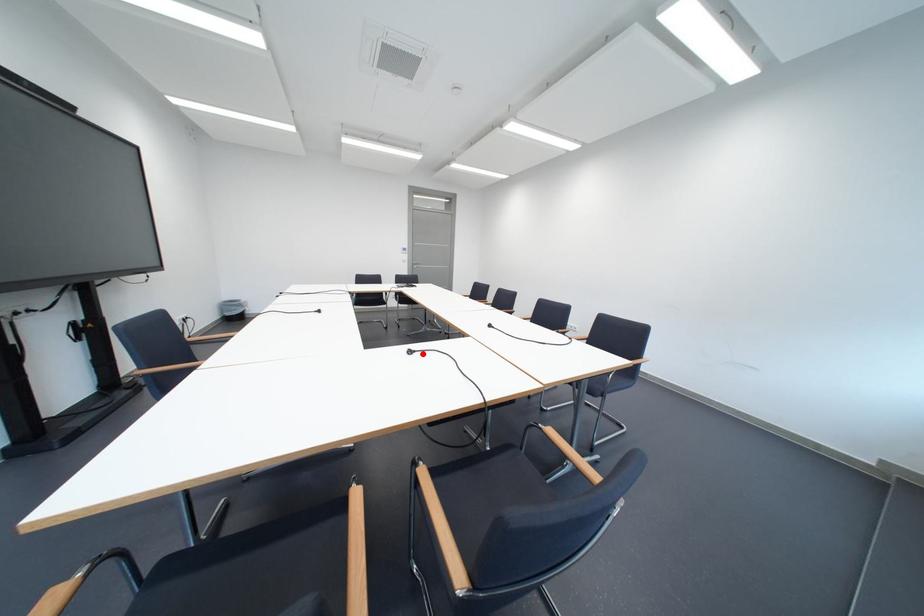
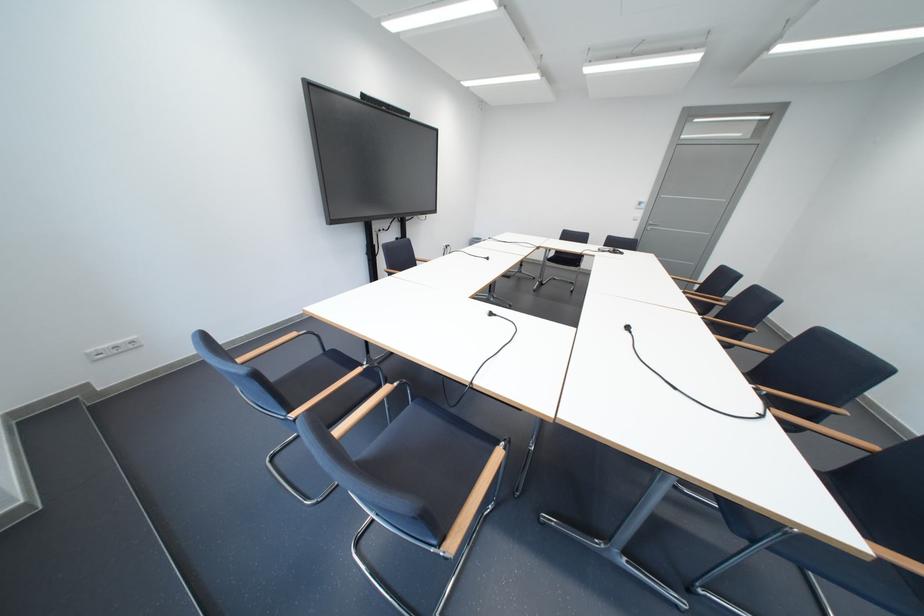
Question: I am providing you with two images of the same scene from different viewpoints. Image1 has a red point marked. In image2, the corresponding 3D location appears at what relative position? Reply with the corresponding letter.

Choices:
 (A) Closer
 (B) Farther

Answer: (B)